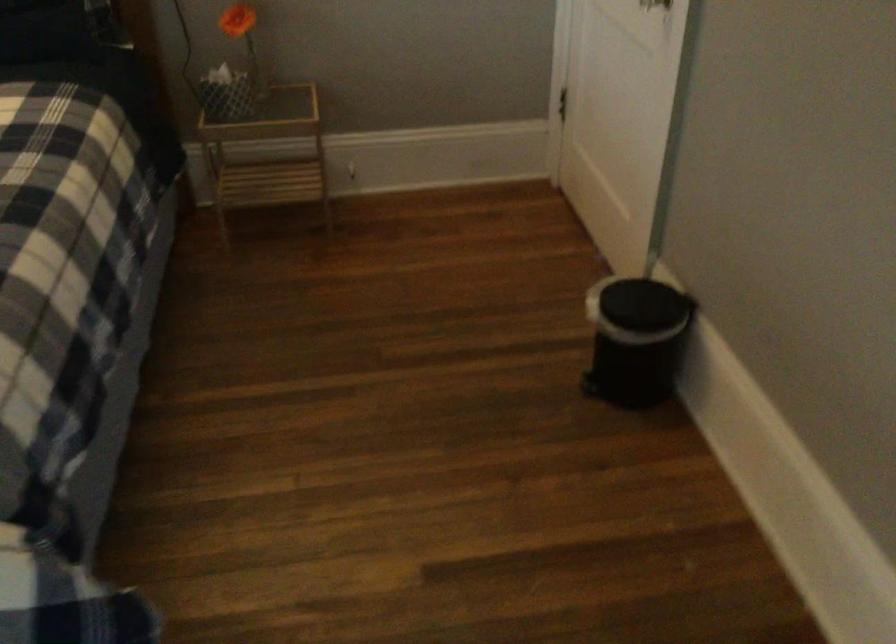
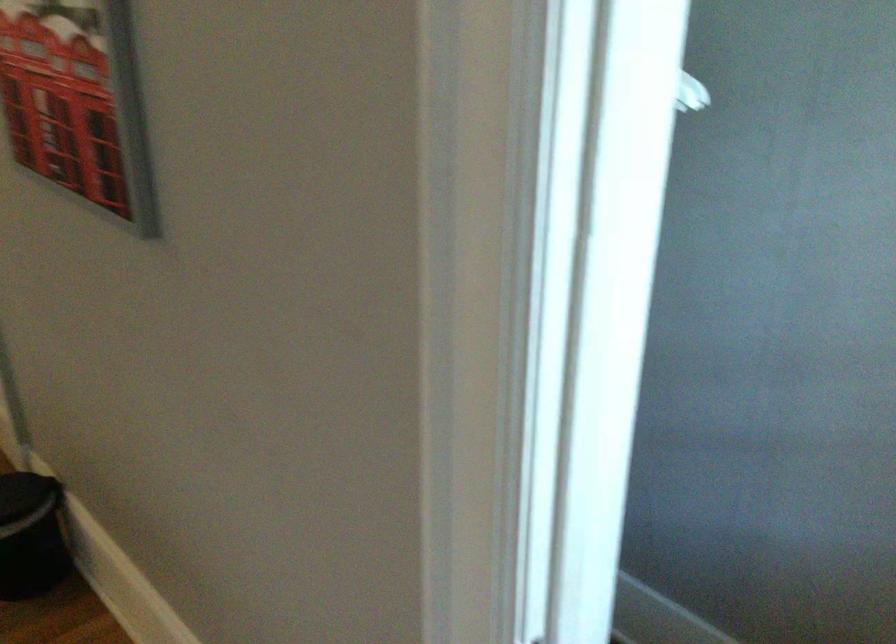
Question: The camera is either moving clockwise (left) or counter-clockwise (right) around the object. The first image is from the beginning of the video and the second image is from the end. Is the camera moving left or right when shooting the video?

Choices:
 (A) Left
 (B) Right

Answer: (A)